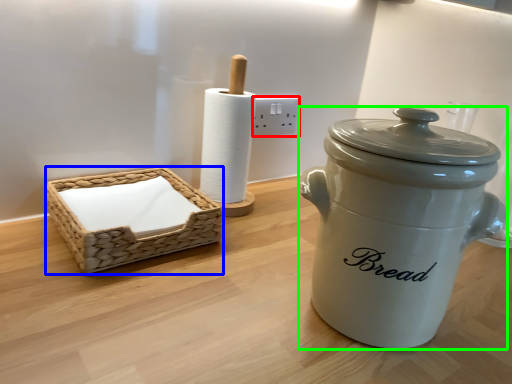
Question: Estimate the real-world distances between objects in this image. Which object is farther from electric outlet (highlighted by a red box), basket (highlighted by a blue box) or crock pot (highlighted by a green box)?

Choices:
 (A) basket
 (B) crock pot

Answer: (B)